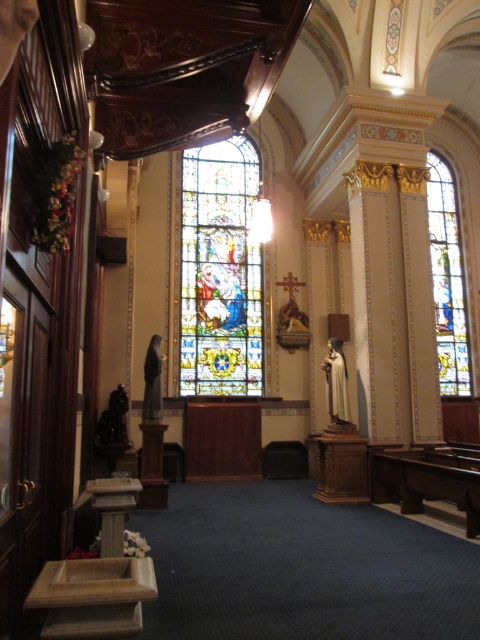
Does point (217, 390) lie in front of point (451, 372)?

Yes, it is in front of point (451, 372).

Does point (244, 332) lie behind point (428, 196)?

No, (244, 332) is in front of (428, 196).

Locate an element on the screen. The width and height of the screenshot is (480, 640). stained glass window at center is located at coordinates (219, 272).